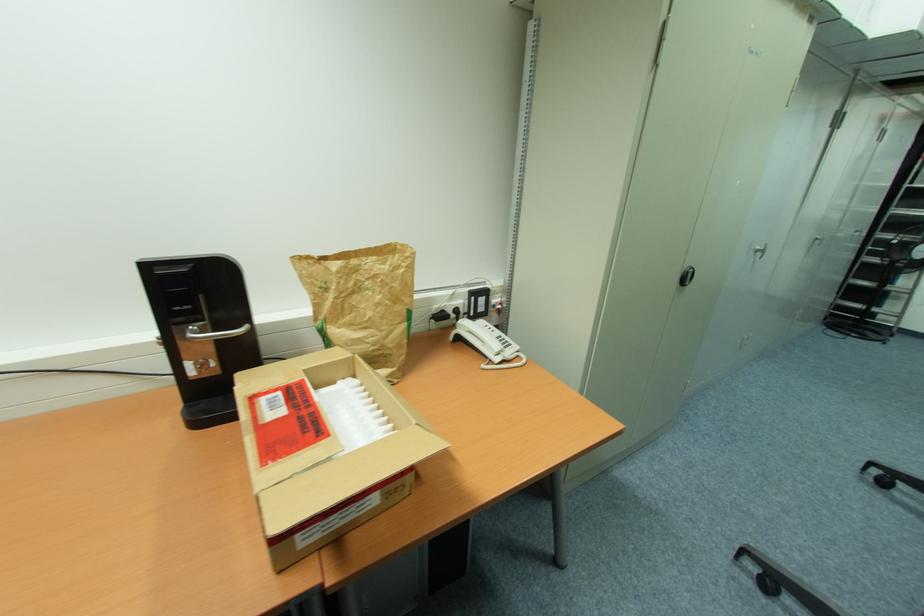
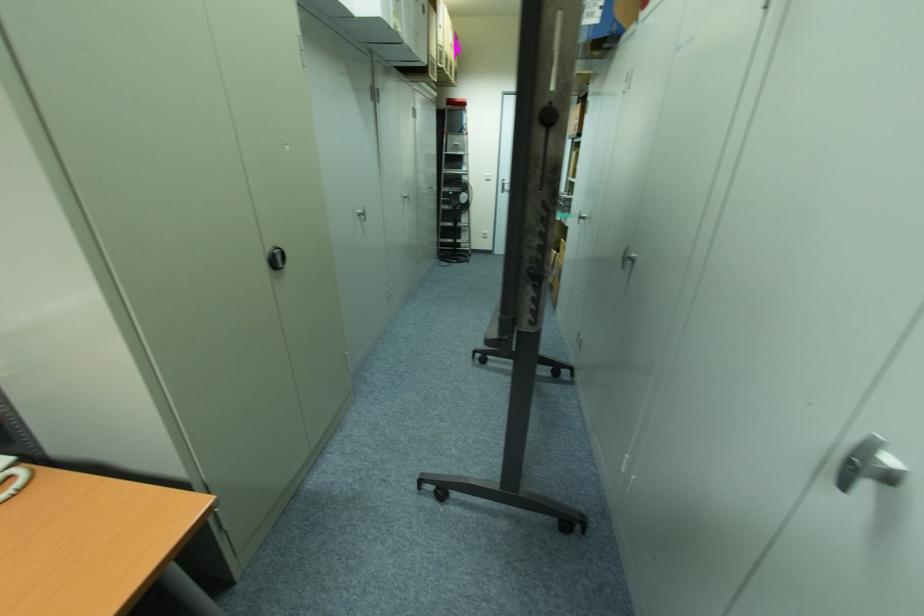
Where in the second image is the point corresponding to pixel 686 280 from the first image?

(278, 262)